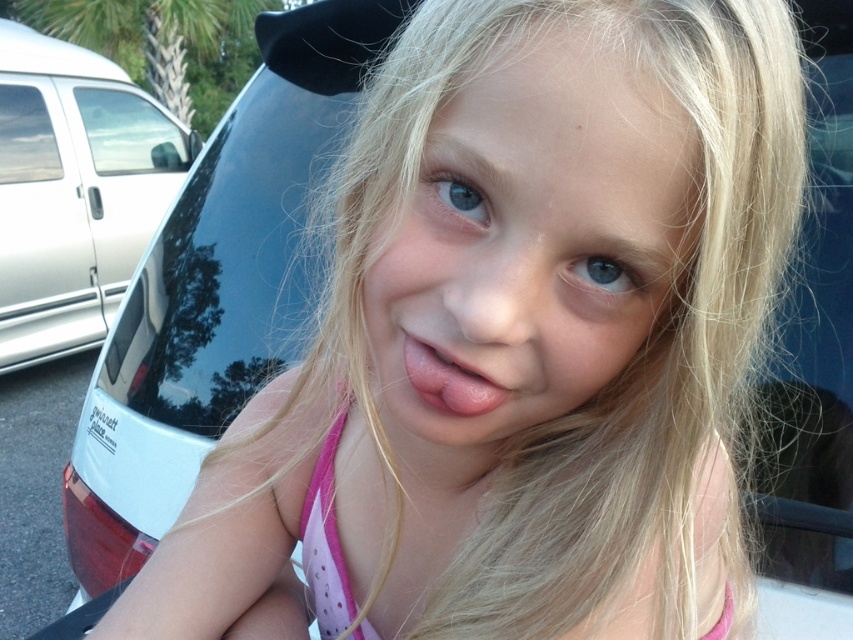
Question: Which of the following is the farthest from the observer?

Choices:
 (A) white metallic van at left
 (B) pink glossy lips at center

Answer: (A)

Question: Which of the following is the farthest from the observer?

Choices:
 (A) pink glossy lips at center
 (B) white metallic van at left
 (C) transparent glass window at upper left
 (D) transparent glass car window at upper left

Answer: (D)

Question: Estimate the real-world distances between objects in this image. Which object is closer to the white metallic van at left?

Choices:
 (A) pink glossy lips at center
 (B) transparent glass car window at upper left

Answer: (B)

Question: Is transparent glass window at upper left below pink glossy lips at center?

Choices:
 (A) no
 (B) yes

Answer: (A)

Question: Is transparent glass car window at upper left to the right of transparent glass window at upper left from the viewer's perspective?

Choices:
 (A) no
 (B) yes

Answer: (B)

Question: In this image, where is white metallic van at left located relative to transparent glass car window at upper left?

Choices:
 (A) above
 (B) below

Answer: (B)